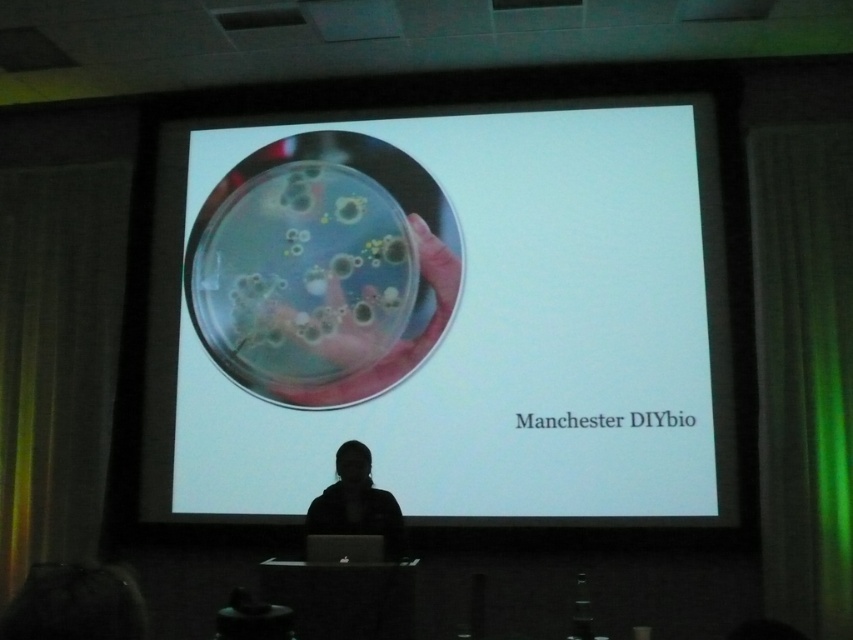
Who is positioned more to the left, green fabric curtain at right or black matte jacket at lower center?

Positioned to the left is black matte jacket at lower center.

Find the location of a particular element. The image size is (853, 640). green fabric curtain at right is located at coordinates (804, 371).